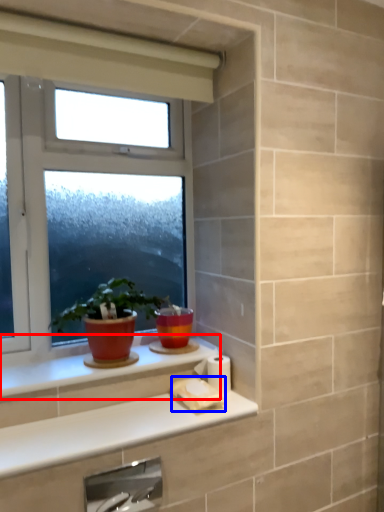
Question: Among these objects, which one is nearest to the camera, window sill (highlighted by a red box) or toilet paper (highlighted by a blue box)?

Choices:
 (A) window sill
 (B) toilet paper

Answer: (A)